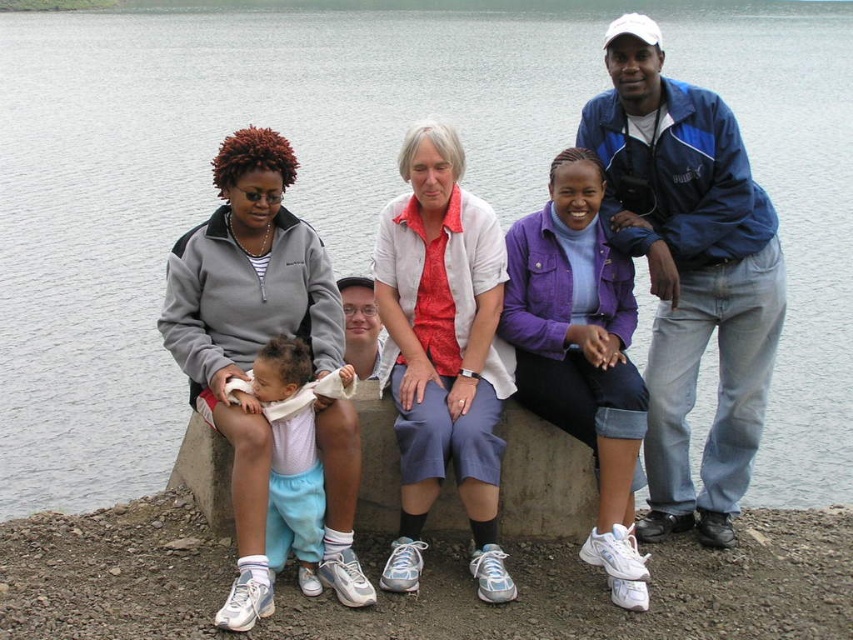
Question: Does gray fleece jacket at center appear over white cotton shirt at center?

Choices:
 (A) yes
 (B) no

Answer: (B)

Question: Among these objects, which one is nearest to the camera?

Choices:
 (A) gray fleece jacket at center
 (B) white cotton shirt at center
 (C) light blue cotton pants at center
 (D) blue fabric jacket at upper right

Answer: (A)

Question: Which object is closer to the camera taking this photo?

Choices:
 (A) light blue cotton pants at center
 (B) gray fleece jacket at center
 (C) blue fabric jacket at upper right
 (D) white cotton shirt at center

Answer: (B)

Question: Does gray fleece jacket at center have a smaller size compared to white cotton shirt at center?

Choices:
 (A) no
 (B) yes

Answer: (A)

Question: Is blue fabric jacket at upper right smaller than gray fleece jacket at center?

Choices:
 (A) no
 (B) yes

Answer: (A)

Question: Among these points, which one is nearest to the camera?

Choices:
 (A) (288, 144)
 (B) (280, 436)
 (C) (428, 124)

Answer: (B)